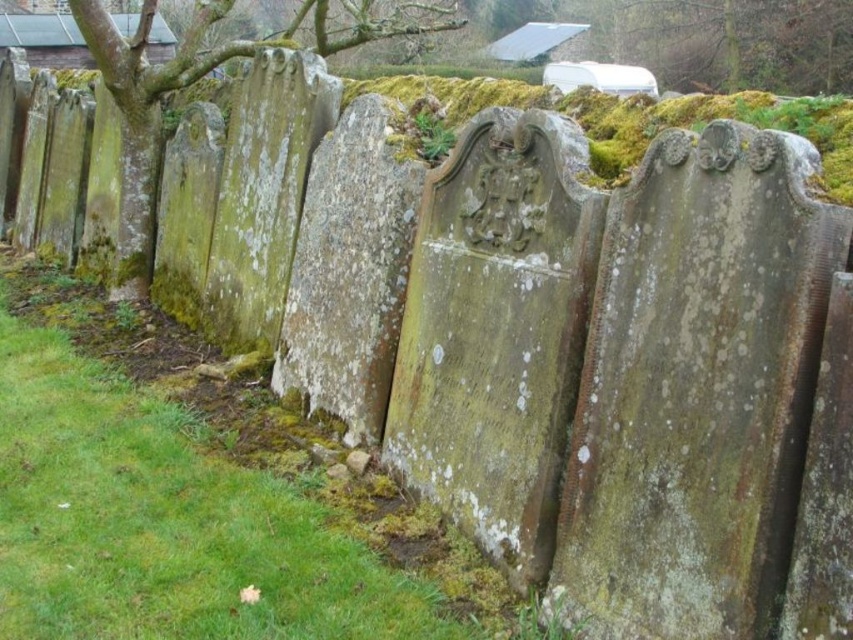
Question: Which point appears farthest from the camera in this image?

Choices:
 (A) (126, 164)
 (B) (165, 381)

Answer: (A)

Question: Can you confirm if green mossy grass at lower left is bigger than green mossy tree at upper left?

Choices:
 (A) no
 (B) yes

Answer: (B)

Question: Can you confirm if green mossy grass at lower left is positioned above green mossy tree at upper left?

Choices:
 (A) no
 (B) yes

Answer: (A)

Question: Can you confirm if green mossy grass at lower left is bigger than green mossy tree at upper left?

Choices:
 (A) yes
 (B) no

Answer: (A)

Question: Among these objects, which one is farthest from the camera?

Choices:
 (A) green mossy tree at upper left
 (B) green mossy grass at lower left

Answer: (A)